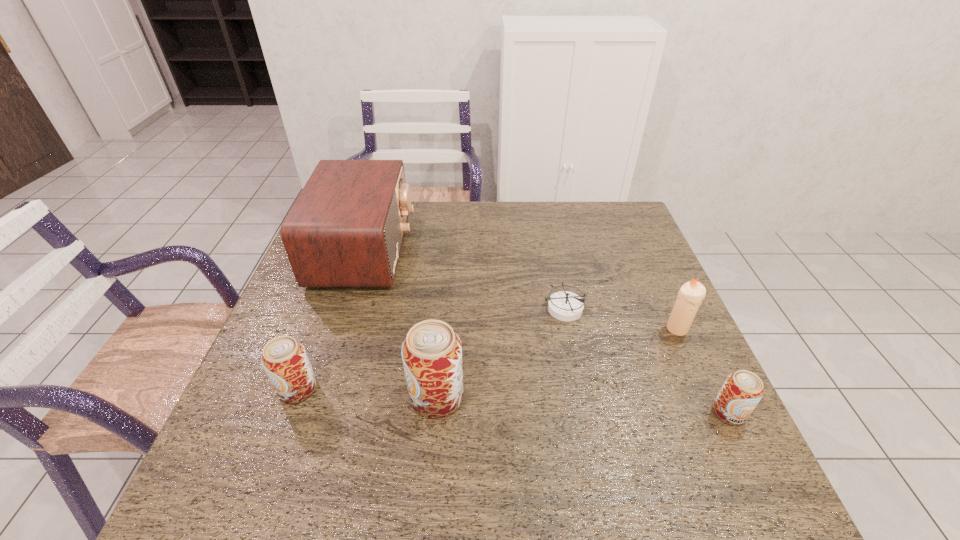
Where is `candle present at the right edge`? This screenshot has width=960, height=540. candle present at the right edge is located at coordinates (689, 298).

Locate an element on the screen. The height and width of the screenshot is (540, 960). object that is at the far left corner is located at coordinates 346,228.

You are a GUI agent. You are given a task and a screenshot of the screen. Output one action in this format:
    pyautogui.click(x=<x>, y=<y>)
    Task: Click on the object located in the near right corner section of the desktop
    The width and height of the screenshot is (960, 540).
    Given the screenshot: What is the action you would take?
    pyautogui.click(x=741, y=392)

In the image, there is a desktop. What are the coordinates of `vacant space at the far edge` in the screenshot? It's located at (434, 239).

You are a GUI agent. You are given a task and a screenshot of the screen. Output one action in this format:
    pyautogui.click(x=<x>, y=<y>)
    Task: Click on the vacant space at the near edge of the desktop
    This screenshot has height=540, width=960.
    Given the screenshot: What is the action you would take?
    pyautogui.click(x=641, y=435)

The image size is (960, 540). In order to click on vacant space at the left edge in this screenshot , I will do `click(321, 295)`.

In the image, there is a desktop. At what (x,y) coordinates should I click in order to perform the action: click on vacant region at the right edge. Please return your answer as a coordinate pair (x, y). The width and height of the screenshot is (960, 540). Looking at the image, I should click on (611, 252).

Locate an element on the screen. blank area at the near left corner is located at coordinates (238, 448).

Where is `vacant space at the far right corner of the desktop`? vacant space at the far right corner of the desktop is located at coordinates (595, 218).

Locate an element on the screen. The width and height of the screenshot is (960, 540). vacant space that is in between the candle and the radio receiver is located at coordinates (521, 289).